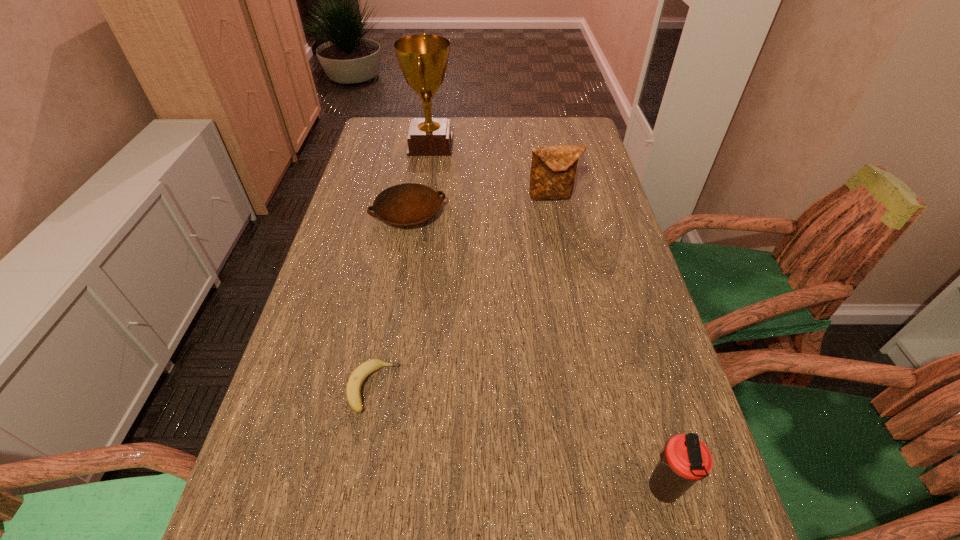
Identify the location of free spot between the nearest object and the award. This screenshot has height=540, width=960. (546, 317).

In order to click on free space between the nearest object and the fourth tallest object in this screenshot , I will do click(535, 352).

You are a GUI agent. You are given a task and a screenshot of the screen. Output one action in this format:
    pyautogui.click(x=<x>, y=<y>)
    Task: Click on the blank region between the plate and the award
    This screenshot has width=960, height=540.
    Given the screenshot: What is the action you would take?
    pyautogui.click(x=420, y=179)

Locate an element on the screen. This screenshot has height=540, width=960. the fourth closest object to the plate is located at coordinates (685, 460).

Identify the location of object that stands as the second closest to the banana. (685, 460).

Locate an element on the screen. The height and width of the screenshot is (540, 960). vacant region that satisfies the following two spatial constraints: 1. on the plaque of the tallest object; 2. on the back side of the thermos bottle is located at coordinates (378, 489).

The height and width of the screenshot is (540, 960). In order to click on free space that satisfies the following two spatial constraints: 1. on the plaque of the farthest object; 2. on the right side of the thermos bottle in this screenshot , I will do `click(378, 489)`.